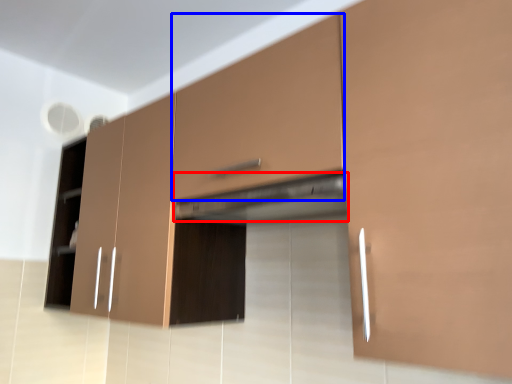
Question: Among these objects, which one is farthest to the camera, exhaust hood (highlighted by a red box) or drawer (highlighted by a blue box)?

Choices:
 (A) exhaust hood
 (B) drawer

Answer: (A)